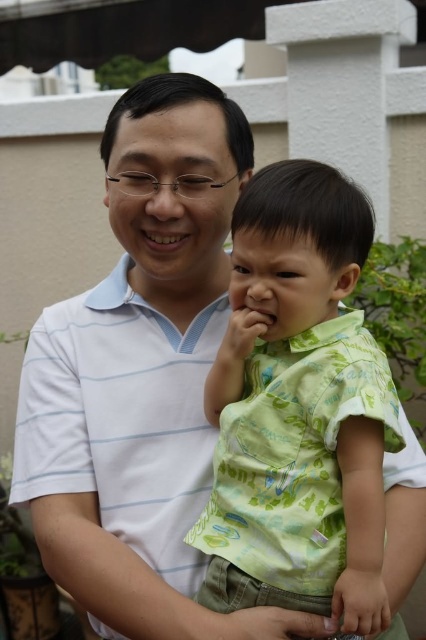
You are a tailor observing the image and need to determine which clothing item is narrower between the green printed shirt at center and the white striped polo shirt at center. Which one is narrower?

The green printed shirt at center is narrower than the white striped polo shirt at center according to the description provided.

You are a photographer trying to capture a closeup of the green printed shirt at center and the white striped polo shirt at center. Which one is closer to the camera?

The green printed shirt at center is in front of the white striped polo shirt at center, so the green printed shirt at center is closer to the camera.

You are standing in the scene and want to walk from point A to point B. Point A is at coordinate point (347, 492) and point B is at coordinate point (140, 532). Since you can only walk forward, will you be able to see point B from point A without any obstructions?

Point (347, 492) is in front of point (140, 532), so yes, you can see point B from point A without any obstructions because there are no objects blocking the line of sight between them.